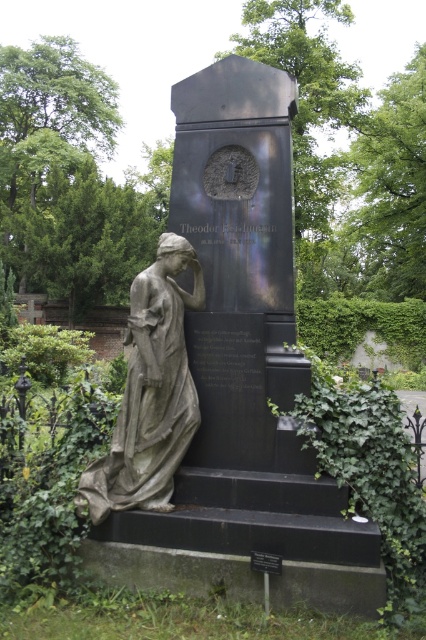
You are a visitor at the cemetery and want to take a photo of both the gray stone statue at center and the gray stone statue at left. Which statue should you focus on first to ensure both are in the frame?

The gray stone statue at center is taller than the gray stone statue at left, so focus on the taller one first to ensure both fit in the frame.

You are a visitor at the cemetery and want to take a photo of both the gray stone statue at center and the gray stone statue at left. However, you can only take one photo from your current position. Based on their positions, will both statues be visible in the photo?

The gray stone statue at center is positioned over the gray stone statue at left, meaning the one at center is in front. Therefore, both statues will be visible as the one in front will not fully block the one behind.